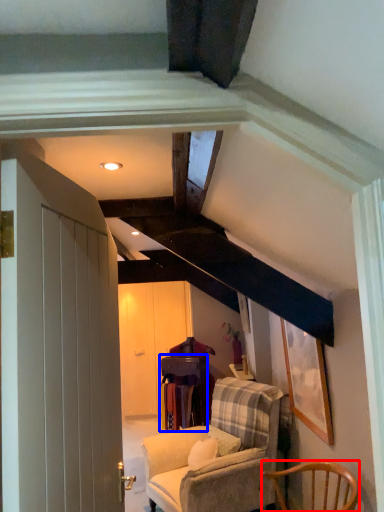
Question: Which object appears farthest to the camera in this image, chair (highlighted by a red box) or table (highlighted by a blue box)?

Choices:
 (A) chair
 (B) table

Answer: (B)